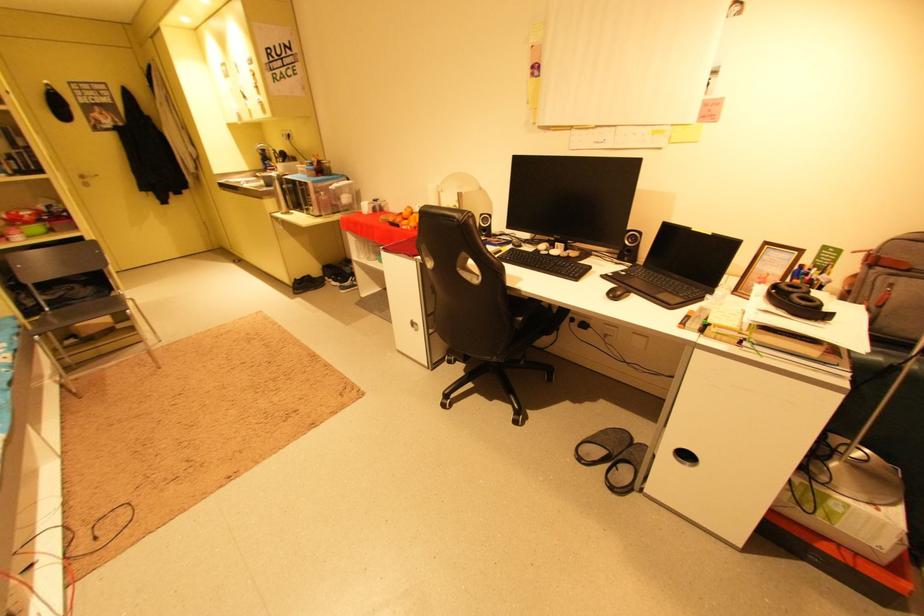
Where is `chair armrest`? This screenshot has height=616, width=924. chair armrest is located at coordinates (548, 317).